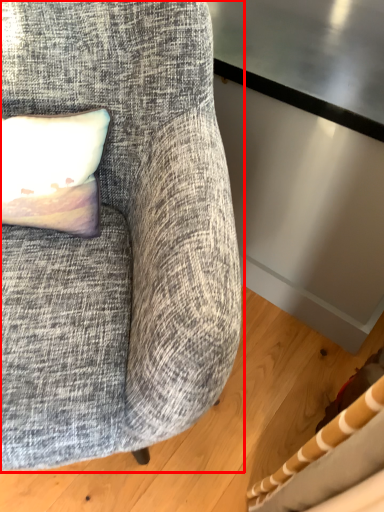
Question: In this image, where is chair (annotated by the red box) located relative to pillow?

Choices:
 (A) left
 (B) right

Answer: (B)